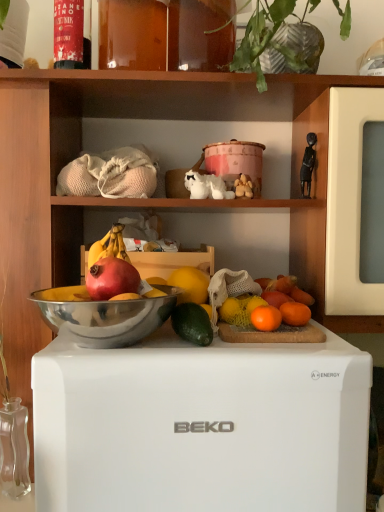
At what (x,y) coordinates should I click in order to perform the action: click on vacant space in front of orange matte at center. Please return your answer as a coordinate pair (x, y). Image resolution: width=384 pixels, height=512 pixels. Looking at the image, I should click on (246, 344).